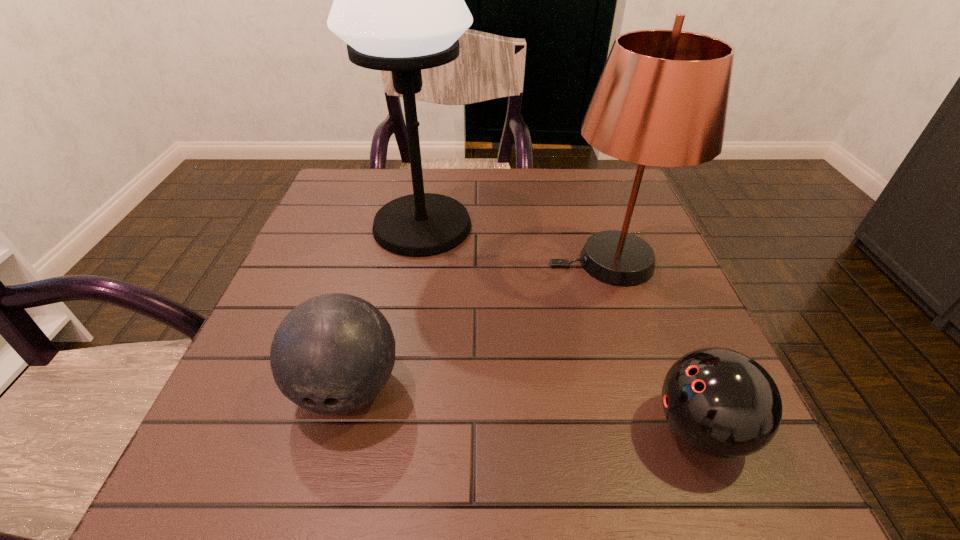
The height and width of the screenshot is (540, 960). Find the location of `free area in between the left bowling ball and the table lamp`. free area in between the left bowling ball and the table lamp is located at coordinates (385, 307).

Find the location of `free space between the tallest object and the taller bowling ball`. free space between the tallest object and the taller bowling ball is located at coordinates (385, 307).

Find the location of a particular element. The height and width of the screenshot is (540, 960). free space between the tallest object and the shorter bowling ball is located at coordinates (562, 328).

Locate an element on the screen. The height and width of the screenshot is (540, 960). free space that is in between the second tallest object and the right bowling ball is located at coordinates (656, 346).

Locate an element on the screen. free point between the table lamp and the lampshade is located at coordinates (516, 244).

The image size is (960, 540). Identify the location of free point between the second shortest object and the lampshade. (479, 325).

Identify the location of free space between the right bowling ball and the left bowling ball. (524, 408).

You are a GUI agent. You are given a task and a screenshot of the screen. Output one action in this format:
    pyautogui.click(x=<x>, y=<y>)
    Task: Click on the unoccupied position between the second tallest object and the shorter bowling ball
    This screenshot has width=960, height=540.
    Given the screenshot: What is the action you would take?
    pyautogui.click(x=656, y=346)

This screenshot has width=960, height=540. I want to click on object that is the second nearest to the lampshade, so click(x=719, y=401).

Identify the location of object that is the third closest to the table lamp. (719, 401).